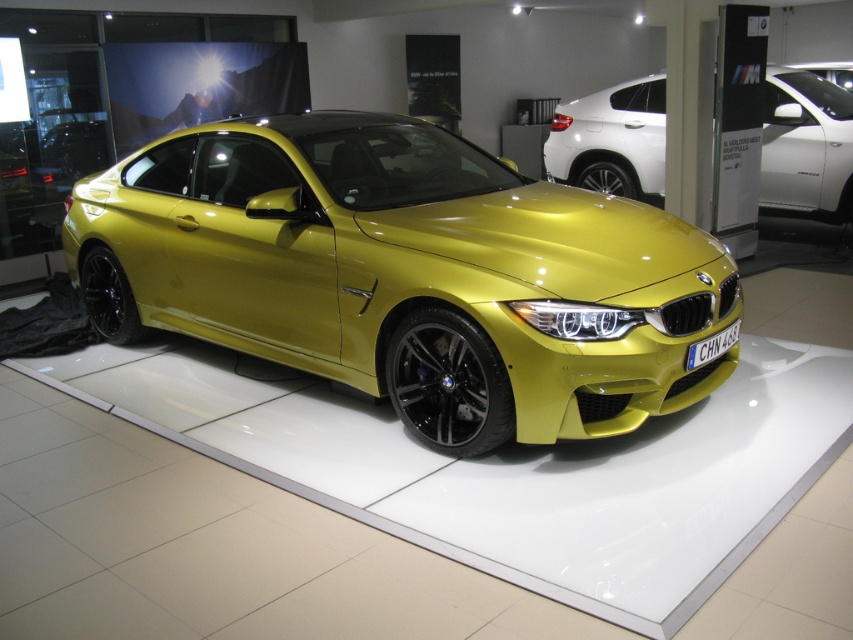
Does metallic yellow car at center appear on the right side of metallic yellow car at upper right?

Incorrect, metallic yellow car at center is not on the right side of metallic yellow car at upper right.

Can you confirm if metallic yellow car at center is taller than metallic yellow car at upper right?

Yes, metallic yellow car at center is taller than metallic yellow car at upper right.

Is point (717, 266) in front of point (778, 109)?

Yes, it is in front of point (778, 109).

This screenshot has width=853, height=640. Identify the location of metallic yellow car at center. (408, 275).